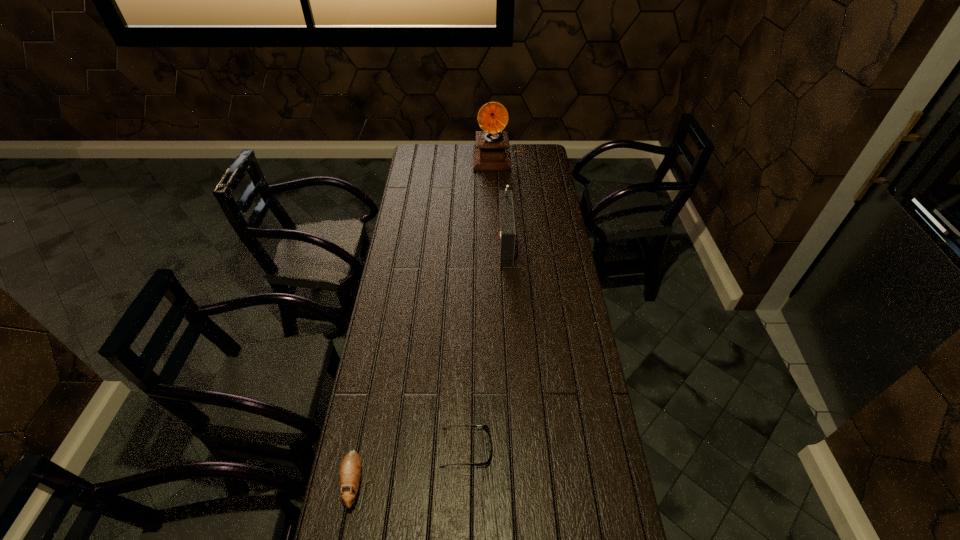
Where is `phonograph record`? This screenshot has width=960, height=540. phonograph record is located at coordinates 492,153.

Find the location of `the tallest object`. the tallest object is located at coordinates (492, 153).

The width and height of the screenshot is (960, 540). I want to click on radio receiver, so click(x=506, y=225).

Find the location of a particular element. the third shortest object is located at coordinates (506, 225).

This screenshot has height=540, width=960. Find the location of `the leftmost object`. the leftmost object is located at coordinates (350, 469).

Find the location of `hamster`. hamster is located at coordinates (350, 469).

This screenshot has height=540, width=960. What are the coordinates of `sunglasses` in the screenshot? It's located at (485, 427).

Where is `free space located on the horn of the phonograph record`? Image resolution: width=960 pixels, height=540 pixels. free space located on the horn of the phonograph record is located at coordinates (502, 218).

Where is `vacant space located 0.160m on the front panel of the radio receiver`? vacant space located 0.160m on the front panel of the radio receiver is located at coordinates (461, 240).

Locate an element on the screen. The image size is (960, 540). free space located 0.110m on the front panel of the radio receiver is located at coordinates (472, 240).